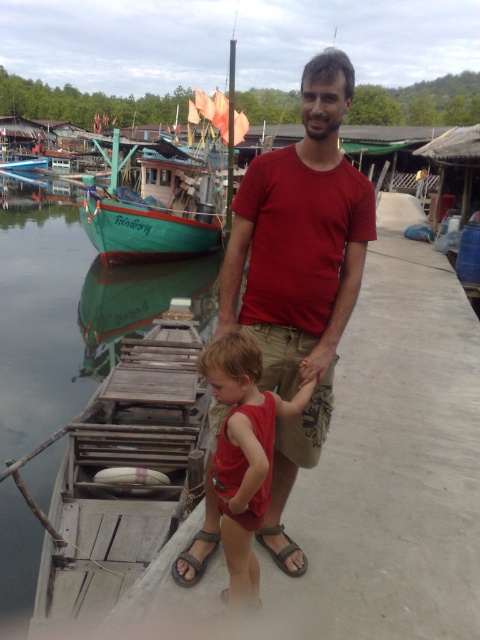
Which is more to the right, matte red t-shirt at center or green matte boat at left?

Positioned to the right is matte red t-shirt at center.

Can you confirm if matte red t-shirt at center is positioned to the right of green matte boat at left?

Correct, you'll find matte red t-shirt at center to the right of green matte boat at left.

Is point (218, 420) behind point (140, 237)?

That is False.

Locate an element on the screen. Image resolution: width=480 pixels, height=640 pixels. matte red t-shirt at center is located at coordinates click(300, 262).

Can you confirm if green reflective water at boat left is positioned below green matte boat at left?

Yes.

Which of these two, green reflective water at boat left or green matte boat at left, stands shorter?

green reflective water at boat left is shorter.

Who is more distant from viewer, (62,609) or (210,232)?

The point (210,232) is more distant.

Where is `green reflective water at boat left`? The height and width of the screenshot is (640, 480). green reflective water at boat left is located at coordinates pos(117,492).

Is point (191, 192) positioned after point (299, 548)?

Yes.

Locate an element on the screen. The image size is (480, 640). green matte boat at left is located at coordinates (151, 211).

The image size is (480, 640). I want to click on green matte boat at left, so click(x=151, y=211).